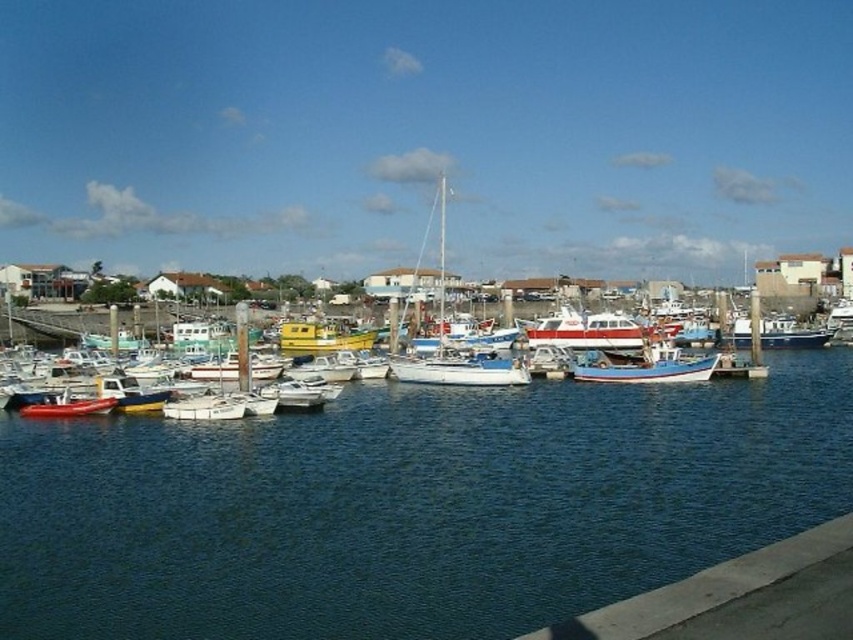
Question: Does concrete at lower right appear over blue painted wooden boat at center?

Choices:
 (A) no
 (B) yes

Answer: (A)

Question: Which object appears closest to the camera in this image?

Choices:
 (A) white matte sailboat at center
 (B) white glossy sailboat at center
 (C) blue painted wooden boat at center

Answer: (B)

Question: Does concrete at lower right have a greater width compared to white matte boat at center?

Choices:
 (A) yes
 (B) no

Answer: (B)

Question: Is white glossy sailboat at center to the left of blue painted wooden boat at center from the viewer's perspective?

Choices:
 (A) yes
 (B) no

Answer: (A)

Question: Which point is closer to the camera taking this photo?

Choices:
 (A) (647, 371)
 (B) (758, 298)
 (C) (782, 364)
 (D) (445, 353)

Answer: (A)

Question: Considering the real-world distances, which object is closest to the concrete at lower right?

Choices:
 (A) white matte sailboat at center
 (B) white matte boat at center

Answer: (A)